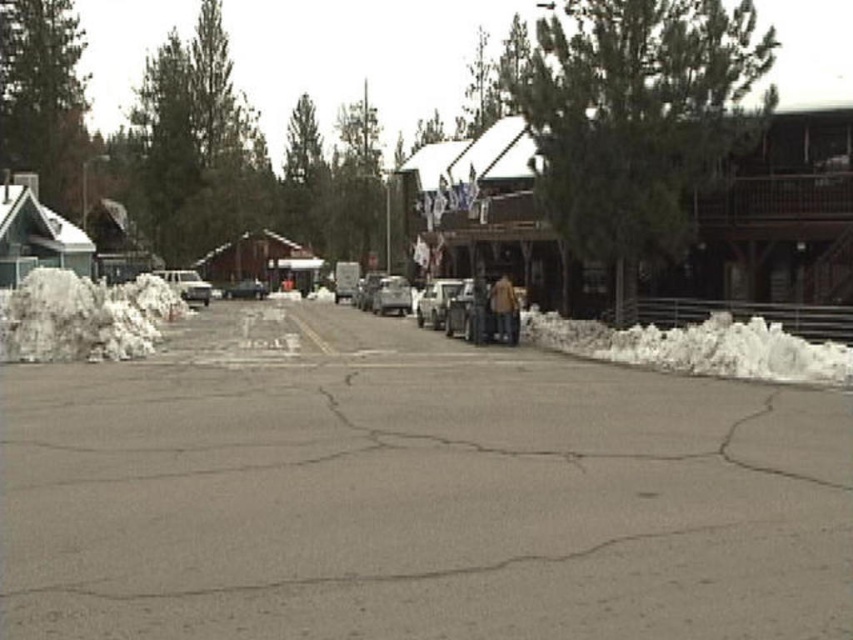
Consider the image. You are driving a car and need to park it on the street. You see the white fluffy snow at left and the silver metallic sedan at center. Which parking spot is closer to the road edge?

The white fluffy snow at left is in front of the silver metallic sedan at center, so the parking spot near the white fluffy snow at left is closer to the road edge.

You are standing on the sidewalk next to the gray asphalt parking lot at center. You want to cross the street to reach the snowbank on the other side. The snowbank is 3 meters away from the parking lot. Can you safely cross the street without needing to walk more than 5 meters?

The gray asphalt parking lot at center and viewer are 5.51 meters apart from each other. Since the snowbank is 3 meters away from the parking lot, the total distance you need to walk is 5.51 meters to reach the parking lot plus 3 meters to the snowbank, totaling 8.51 meters. This exceeds the 5 meters limit, so you cannot safely cross without walking more than 5 meters.

You are a pedestrian standing at the edge of the street. You see both the white matte car at center and the silver metallic sedan at center. Which car is nearer to you?

The white matte car at center is closer to the viewer than the silver metallic sedan at center, so the white matte car at center is nearer.